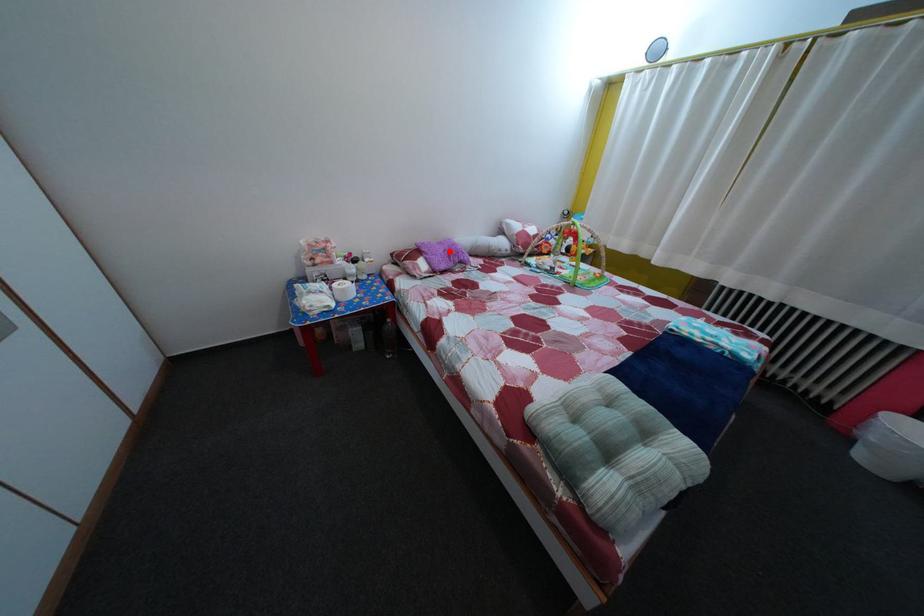
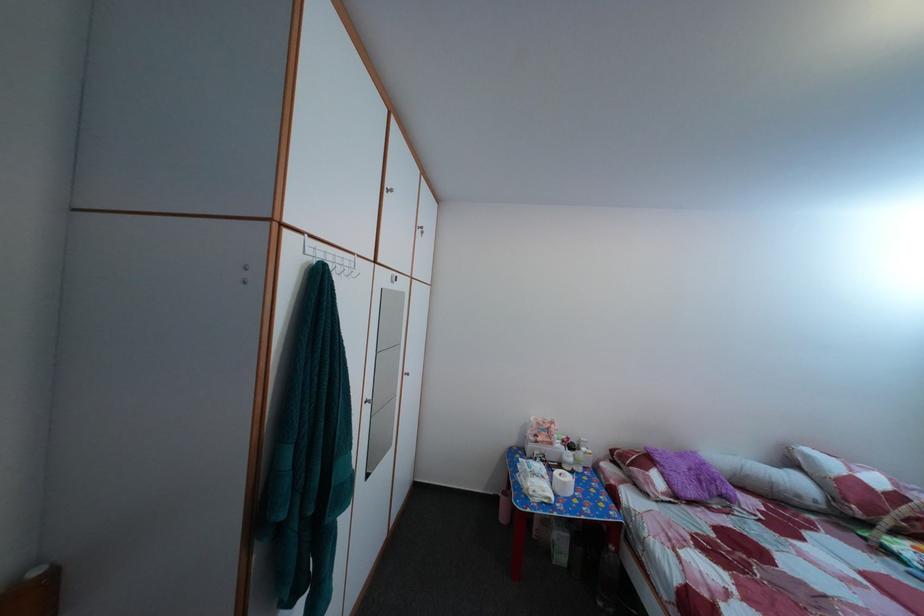
Locate, in the second image, the point that corresponds to the highlighted location in the first image.

(689, 464)